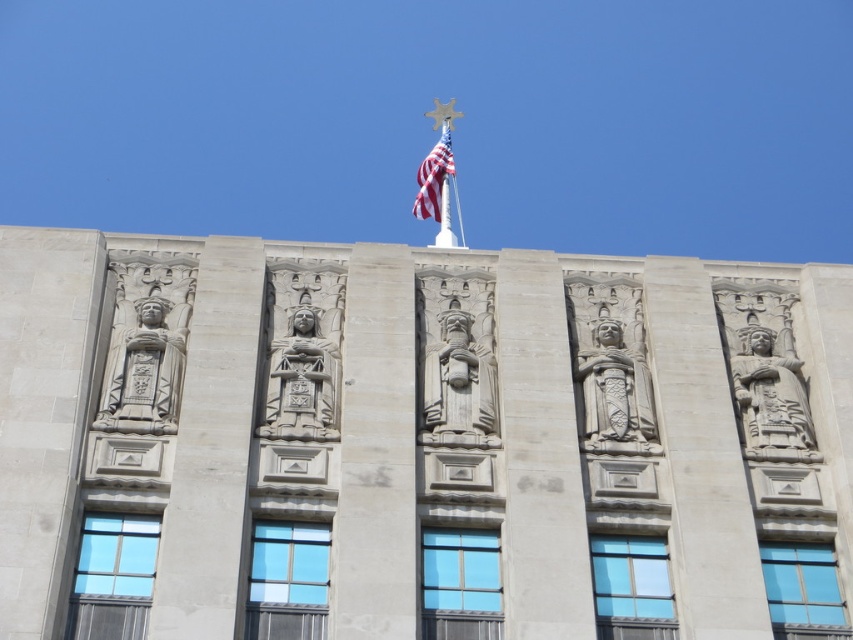
You are an architect inspecting the building facade. You notice the gray stone statue at center left and the polished stone statue at center. Based on their positions, which one is closer to the flagpole?

The polished stone statue at center is closer to the flagpole because it is above the gray stone statue at center left, which is positioned below it.

You are standing in front of the building and want to locate the carved stone pillar at center. What are the coordinates where you can find it?

The carved stone pillar at center can be found at coordinates point (538, 454).